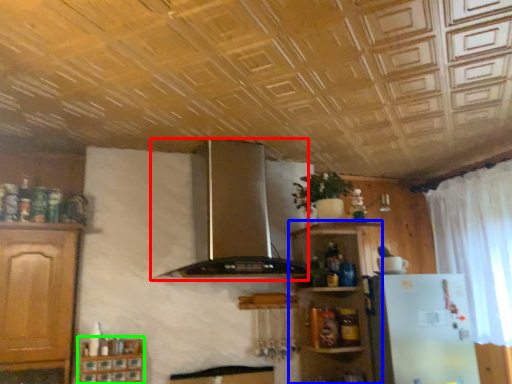
Question: Which object is the farthest from exhaust hood (highlighted by a red box)? Choose among these: shelf (highlighted by a blue box) or cabinetry (highlighted by a green box).

Choices:
 (A) shelf
 (B) cabinetry

Answer: (B)